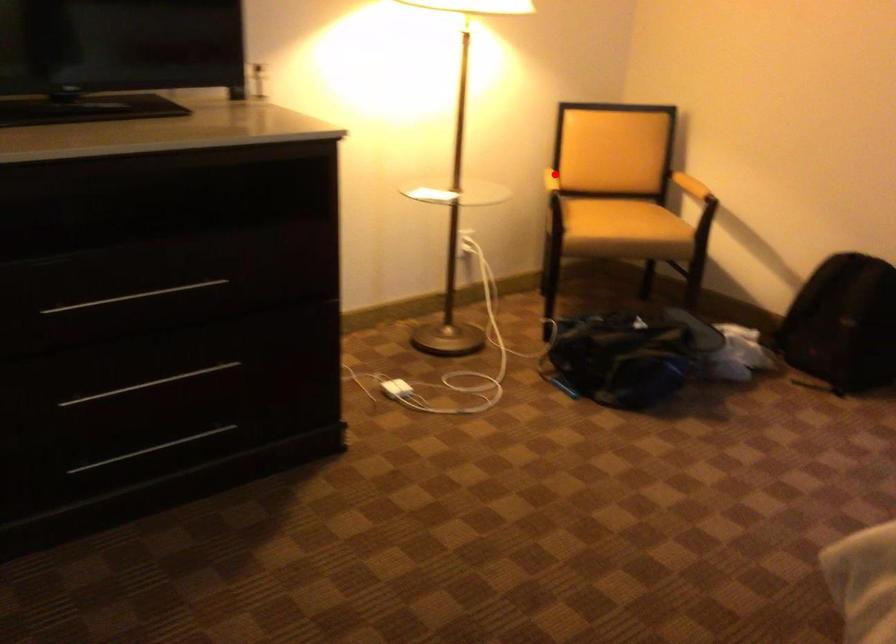
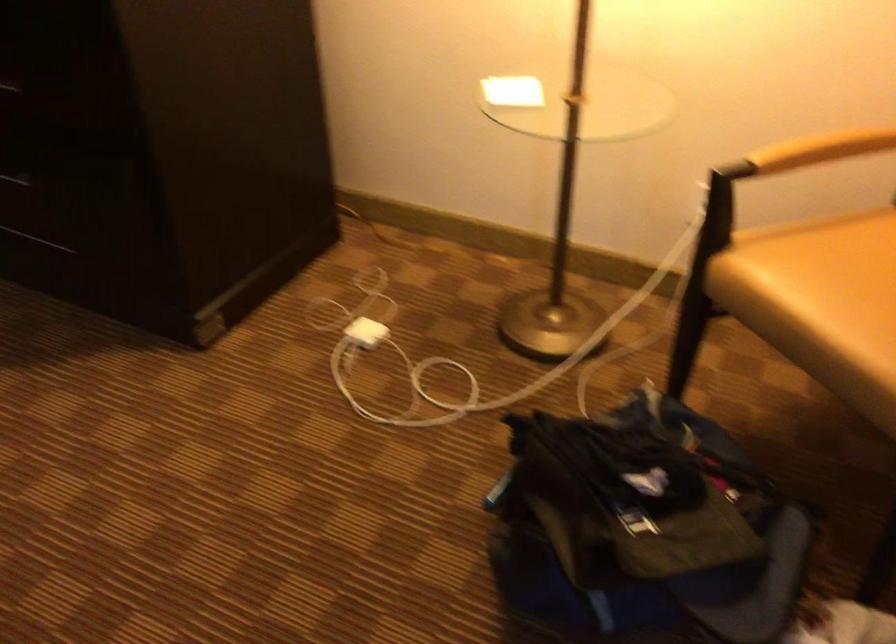
Question: I am providing you with two images of the same scene from different viewpoints. In image1, a red point is highlighted. Considering the same 3D point in image2, which of the following is correct?

Choices:
 (A) It is closer
 (B) It is farther

Answer: (A)